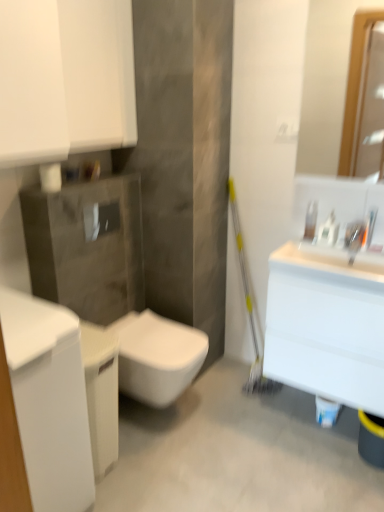
The height and width of the screenshot is (512, 384). In order to click on white glossy sink at upper right in this screenshot , I will do `click(331, 264)`.

Where is `white glossy bottle at upper right`? The height and width of the screenshot is (512, 384). white glossy bottle at upper right is located at coordinates (328, 231).

What is the approximate width of white glossy cabinet at upper left?

It is 7.89 inches.

Where is `white glossy toilet at center`? This screenshot has height=512, width=384. white glossy toilet at center is located at coordinates (157, 356).

Describe the element at coordinates (157, 356) in the screenshot. The width and height of the screenshot is (384, 512). I see `white glossy toilet at center` at that location.

You are a GUI agent. You are given a task and a screenshot of the screen. Output one action in this format:
    pyautogui.click(x=<x>, y=<y>)
    Task: Click on the satin nickel faucet at upper right
    
    Given the screenshot: What is the action you would take?
    pyautogui.click(x=354, y=236)

Is satin nickel faucet at upper right touching clear plastic soap dispenser at upper right?

No, satin nickel faucet at upper right is not in contact with clear plastic soap dispenser at upper right.

Does satin nickel faucet at upper right come behind clear plastic soap dispenser at upper right?

No, satin nickel faucet at upper right is closer to the camera.

Locate an element on the screen. The width and height of the screenshot is (384, 512). faucet below the clear plastic soap dispenser at upper right (from a real-world perspective) is located at coordinates (354, 236).

Which of these two, matte wooden mirror at upper right or white glossy sink at upper right, is wider?

white glossy sink at upper right.

Is white glossy sink at upper right at the back of matte wooden mirror at upper right?

matte wooden mirror at upper right does not have its back to white glossy sink at upper right.

Considering the points (348, 56) and (288, 252), which point is in front, point (348, 56) or point (288, 252)?

The point (288, 252) is more forward.

Does matte wooden mirror at upper right lie in front of white glossy sink at upper right?

Yes, the depth of matte wooden mirror at upper right is less than that of white glossy sink at upper right.

From a real-world perspective, between satin nickel faucet at upper right and white glossy bottle at upper right, who is vertically higher?

white glossy bottle at upper right is physically above.

Considering the sizes of objects satin nickel faucet at upper right and white glossy bottle at upper right in the image provided, who is thinner, satin nickel faucet at upper right or white glossy bottle at upper right?

With smaller width is white glossy bottle at upper right.

Is point (345, 242) more distant than point (329, 237)?

No, it is not.

What's the angular difference between white glossy toilet at center and clear plastic soap dispenser at upper right's facing directions?

The facing directions of white glossy toilet at center and clear plastic soap dispenser at upper right are 87.3 degrees apart.

Does white glossy toilet at center have a greater width compared to clear plastic soap dispenser at upper right?

Indeed, white glossy toilet at center has a greater width compared to clear plastic soap dispenser at upper right.

In the image, is white glossy toilet at center on the left side or the right side of clear plastic soap dispenser at upper right?

From the image, it's evident that white glossy toilet at center is to the left of clear plastic soap dispenser at upper right.

Locate an element on the screen. toilet located underneath the clear plastic soap dispenser at upper right (from a real-world perspective) is located at coordinates (157, 356).

Can you confirm if white glossy sink at upper right is shorter than matte wooden mirror at upper right?

A: Correct, white glossy sink at upper right is not as tall as matte wooden mirror at upper right.

Considering the relative positions of white glossy sink at upper right and matte wooden mirror at upper right in the image provided, is white glossy sink at upper right to the left or to the right of matte wooden mirror at upper right?

Clearly, white glossy sink at upper right is on the left of matte wooden mirror at upper right in the image.

Between white glossy sink at upper right and matte wooden mirror at upper right, which one has larger width?

Wider between the two is white glossy sink at upper right.

Considering the sizes of objects white glossy sink at upper right and matte wooden mirror at upper right in the image provided, who is bigger, white glossy sink at upper right or matte wooden mirror at upper right?

matte wooden mirror at upper right is bigger.

Could you tell me if white glossy toilet at center is facing white glossy bottle at upper right?

No, white glossy toilet at center is not facing towards white glossy bottle at upper right.

Between white glossy toilet at center and white glossy bottle at upper right, which one has smaller size?

With smaller size is white glossy bottle at upper right.

From a real-world perspective, is white glossy toilet at center physically above white glossy bottle at upper right?

No, from a real-world perspective, white glossy toilet at center is not over white glossy bottle at upper right

Between white glossy toilet at center and white glossy bottle at upper right, which one has smaller width?

Thinner between the two is white glossy bottle at upper right.

What's the angular difference between white glossy cabinet at left and satin nickel faucet at upper right's facing directions?

86.2 degrees separate the facing orientations of white glossy cabinet at left and satin nickel faucet at upper right.

Which is behind, point (79, 431) or point (346, 229)?

Positioned behind is point (346, 229).

Does white glossy cabinet at left appear on the right side of satin nickel faucet at upper right?

No.

Considering the sizes of white glossy cabinet at left and satin nickel faucet at upper right in the image, is white glossy cabinet at left bigger or smaller than satin nickel faucet at upper right?

white glossy cabinet at left is bigger than satin nickel faucet at upper right.

Find the location of a particular element. soap dispenser on the left side of satin nickel faucet at upper right is located at coordinates (311, 220).

Find the location of `sink lying below the matte wooden mirror at upper right (from the image's perspective)`. sink lying below the matte wooden mirror at upper right (from the image's perspective) is located at coordinates (331, 264).

When comparing their distances from satin nickel faucet at upper right, does matte wooden mirror at upper right or white glossy bottle at upper right seem further?

matte wooden mirror at upper right lies further to satin nickel faucet at upper right than the other object.

Based on their spatial positions, is clear plastic soap dispenser at upper right or white glossy cabinet at left closer to white glossy bottle at upper right?

clear plastic soap dispenser at upper right is closer to white glossy bottle at upper right.

Consider the image. Estimate the real-world distances between objects in this image. Which object is closer to clear plastic soap dispenser at upper right, white glossy toilet at center or white glossy cabinet at left?

white glossy toilet at center is positioned closer to the anchor clear plastic soap dispenser at upper right.

Which object lies nearer to the anchor point clear plastic soap dispenser at upper right, white glossy cabinet at upper left or white glossy sink at right?

Among the two, white glossy sink at right is located nearer to clear plastic soap dispenser at upper right.

From the image, which object appears to be farther from white glossy cabinet at left, matte wooden mirror at upper right or white glossy bottle at upper right?

matte wooden mirror at upper right is further to white glossy cabinet at left.

From the image, which object appears to be nearer to matte wooden mirror at upper right, clear plastic soap dispenser at upper right or satin nickel faucet at upper right?

Among the two, clear plastic soap dispenser at upper right is located nearer to matte wooden mirror at upper right.

When comparing their distances from matte wooden mirror at upper right, does white glossy bottle at upper right or clear plastic soap dispenser at upper right seem closer?

Based on the image, clear plastic soap dispenser at upper right appears to be nearer to matte wooden mirror at upper right.

Which object lies further to the anchor point white glossy cabinet at left, white glossy cabinet at upper left or white glossy bottle at upper right?

The object further to white glossy cabinet at left is white glossy bottle at upper right.

Locate an element on the screen. sink between white glossy toilet at center and white glossy bottle at upper right from left to right is located at coordinates (331, 264).

Identify the location of sink between white glossy cabinet at left and satin nickel faucet at upper right. click(x=331, y=264).

Where is `toilet between white glossy cabinet at left and clear plastic soap dispenser at upper right from left to right`? toilet between white glossy cabinet at left and clear plastic soap dispenser at upper right from left to right is located at coordinates (157, 356).

The image size is (384, 512). Identify the location of toilet between white glossy cabinet at left and white glossy sink at right from left to right. (157, 356).